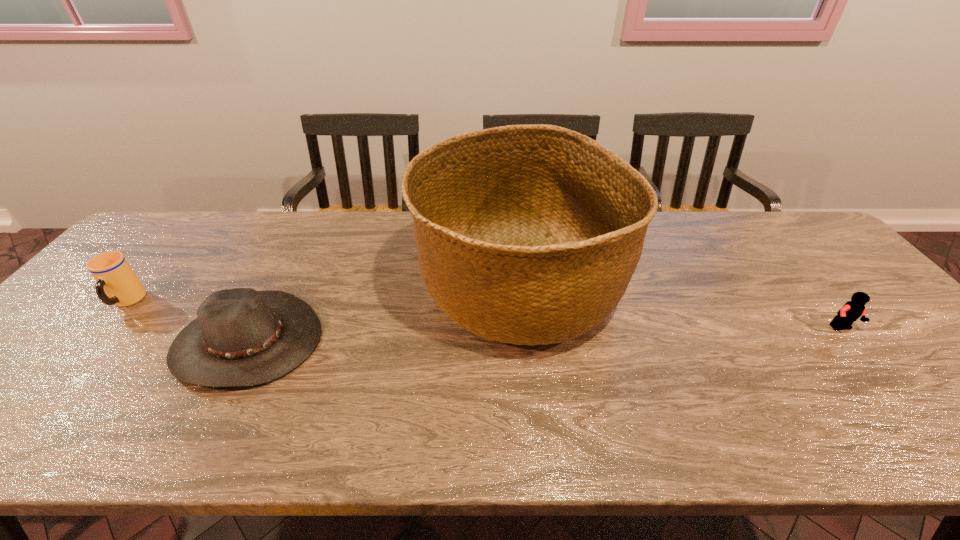
Find the location of a particular element. vacant space that's between the cup and the basket is located at coordinates (323, 294).

Where is `vacant area between the cup and the hat`? vacant area between the cup and the hat is located at coordinates pyautogui.click(x=187, y=321).

Where is `vacant space that's between the rightmost object and the basket`? Image resolution: width=960 pixels, height=540 pixels. vacant space that's between the rightmost object and the basket is located at coordinates (680, 308).

Identify the location of free space that is in between the second object from right to left and the cup. (x=323, y=294).

Image resolution: width=960 pixels, height=540 pixels. I want to click on free area in between the third object from right to left and the basket, so click(x=383, y=314).

Select which object is the second closest to the second object from left to right. Please provide its 2D coordinates. Your answer should be formatted as a tuple, i.e. [(x, y)], where the tuple contains the x and y coordinates of a point satisfying the conditions above.

[(529, 234)]

The height and width of the screenshot is (540, 960). Find the location of `object that ranks as the closest to the hat`. object that ranks as the closest to the hat is located at coordinates (117, 284).